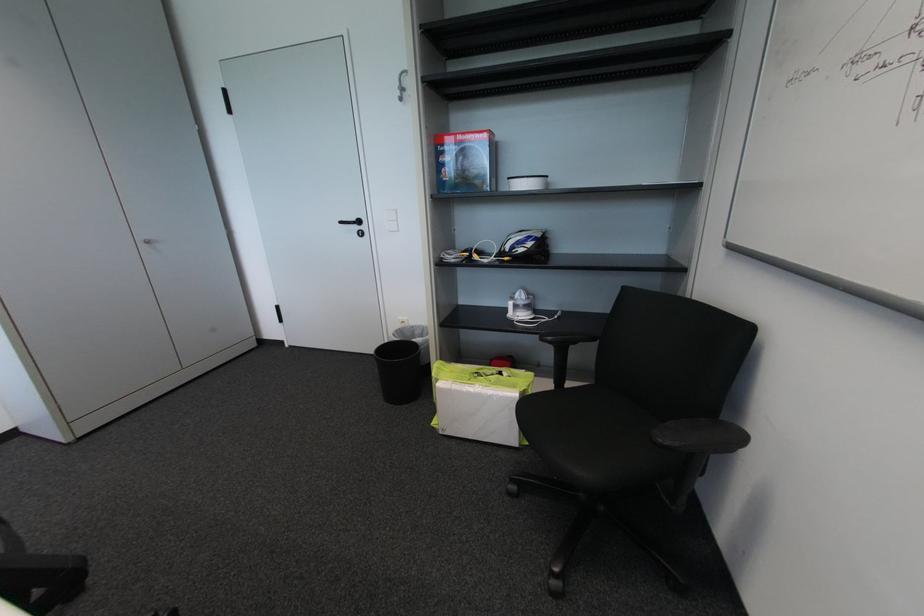
You are a GUI agent. You are given a task and a screenshot of the screen. Output one action in this format:
    pyautogui.click(x=<x>, y=<y>)
    Task: Click on the chair sitting surface
    This screenshot has width=924, height=616.
    Given the screenshot: What is the action you would take?
    [x=609, y=431]